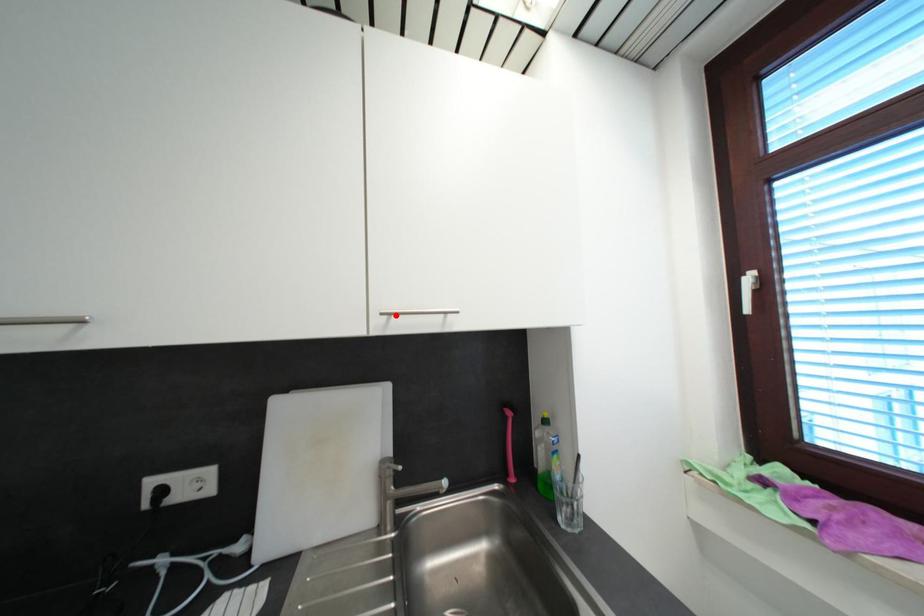
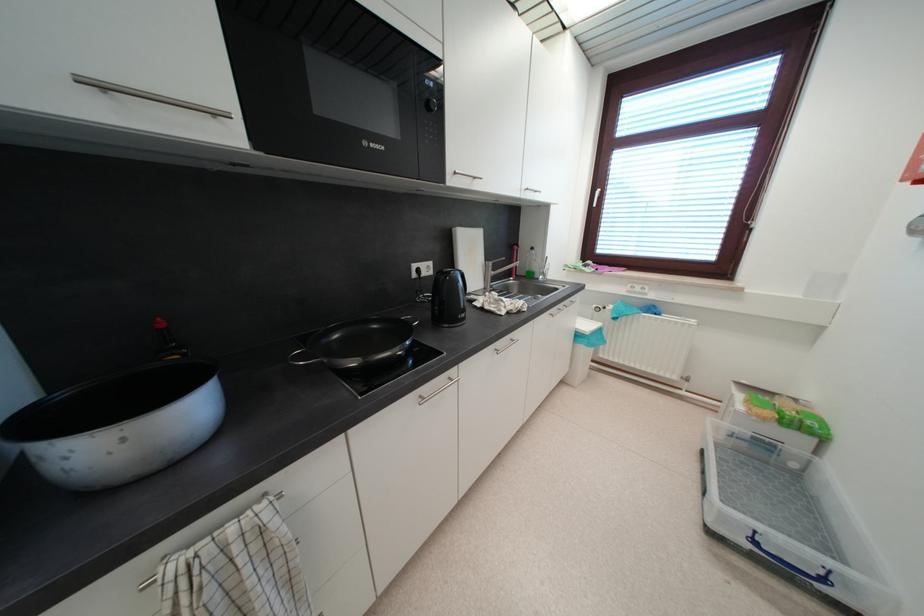
Where in the second image is the point corresponding to the highlighted location from the first image?

(530, 192)